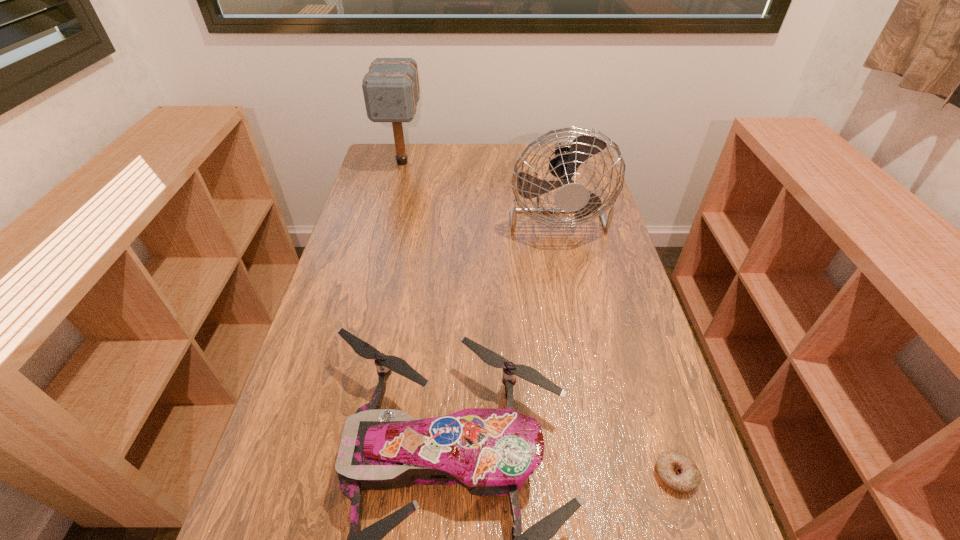
Select which object appears as the closest to the mallet. Please provide its 2D coordinates. Your answer should be formatted as a tuple, i.e. [(x, y)], where the tuple contains the x and y coordinates of a point satisfying the conditions above.

[(572, 197)]

Identify the location of the closest object to the mallet. The height and width of the screenshot is (540, 960). (572, 197).

You are a GUI agent. You are given a task and a screenshot of the screen. Output one action in this format:
    pyautogui.click(x=<x>, y=<y>)
    Task: Click on the vacant region that satisfies the following two spatial constraints: 1. on the front-facing side of the doughnut; 2. on the right side of the fan
    
    Given the screenshot: What is the action you would take?
    pyautogui.click(x=611, y=475)

Locate an element on the screen. The width and height of the screenshot is (960, 540). vacant space that satisfies the following two spatial constraints: 1. on the front-facing side of the doughnut; 2. on the right side of the fan is located at coordinates (611, 475).

You are a GUI agent. You are given a task and a screenshot of the screen. Output one action in this format:
    pyautogui.click(x=<x>, y=<y>)
    Task: Click on the vacant space that satisfies the following two spatial constraints: 1. on the striking surface of the mallet; 2. on the left side of the doughnut
    The height and width of the screenshot is (540, 960).
    Given the screenshot: What is the action you would take?
    pyautogui.click(x=324, y=475)

Find the location of a particular element. free space that satisfies the following two spatial constraints: 1. on the front-facing side of the fan; 2. on the right side of the doughnut is located at coordinates (611, 475).

Where is `free spot that satisfies the following two spatial constraints: 1. on the striking surface of the doughnut; 2. on the left side of the mallet`? free spot that satisfies the following two spatial constraints: 1. on the striking surface of the doughnut; 2. on the left side of the mallet is located at coordinates (324, 475).

Locate an element on the screen. vacant point that satisfies the following two spatial constraints: 1. on the striking surface of the mallet; 2. on the right side of the shortest object is located at coordinates (324, 475).

Find the location of a particular element. blank space that satisfies the following two spatial constraints: 1. on the front-facing side of the shortest object; 2. on the right side of the fan is located at coordinates (611, 475).